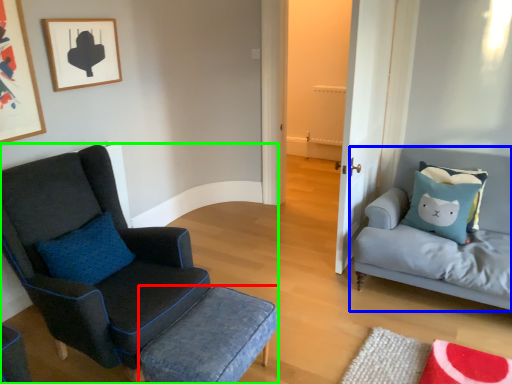
Question: Which is nearer to the stool (highlighted by a red box)? studio couch (highlighted by a blue box) or chair (highlighted by a green box).

Choices:
 (A) studio couch
 (B) chair

Answer: (B)